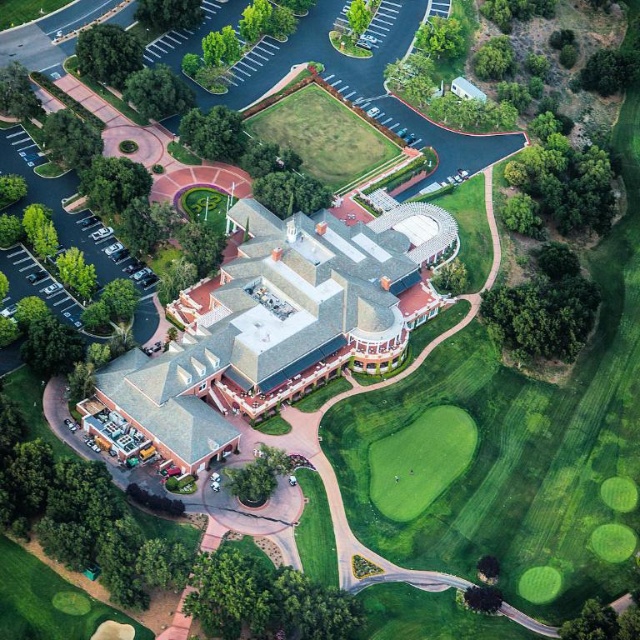
You are a guest arriving at the resort and want to park your car in the parking lot. You notice the light brown stone mansion at center and the green smooth turf at center. Which object is closer to the parking lot?

The light brown stone mansion at center is positioned over the green smooth turf at center, so the mansion is closer to the parking lot than the turf.

You are planning to install a new pathway between the light brown stone mansion at center and the green smooth turf at center. The pathway will be 18 meters long. Will the pathway be long enough to connect them?

The light brown stone mansion at center and green smooth turf at center are 18.59 meters apart from each other. The proposed pathway is 18 meters long, which is shorter than the required distance. Therefore, the pathway will not be long enough to connect them.

You are standing at the entrance of the resort and want to reach the green smooth turf at center. Which direction should you walk relative to the light brown stone mansion at center?

The light brown stone mansion at center is in front of the green smooth turf at center, so you should walk behind the light brown stone mansion at center to reach the green smooth turf at center.